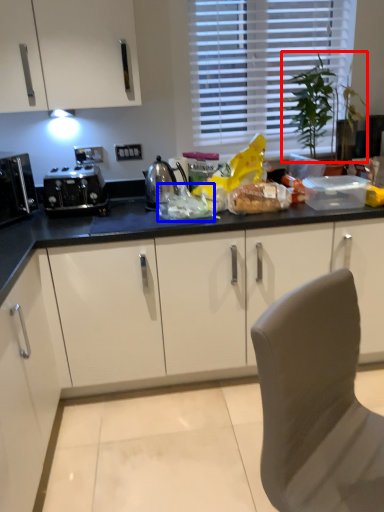
Question: Which object appears farthest to the camera in this image, plant (highlighted by a red box) or food (highlighted by a blue box)?

Choices:
 (A) plant
 (B) food

Answer: (A)